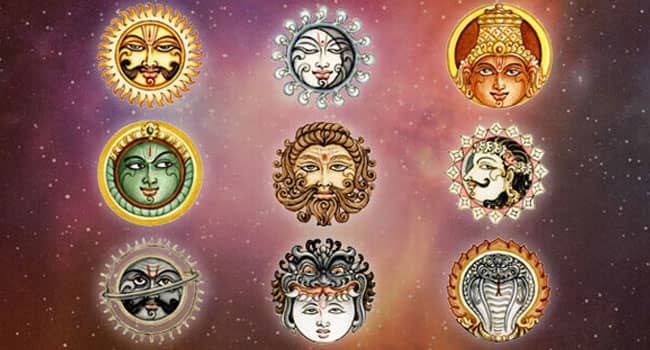
Locate an element on the screen. This screenshot has width=650, height=350. glowing light is located at coordinates (x=402, y=234), (x=257, y=144).